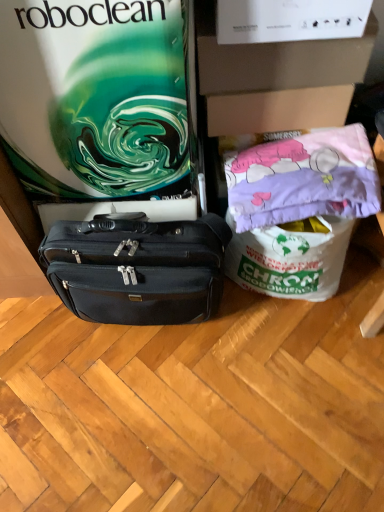
This screenshot has width=384, height=512. What do you see at coordinates (277, 60) in the screenshot? I see `white cardboard box at upper center` at bounding box center [277, 60].

The width and height of the screenshot is (384, 512). In order to click on black leather briefcase at center in this screenshot , I will do `click(137, 268)`.

Identify the location of white cardboard box at upper center. The width and height of the screenshot is (384, 512). (277, 60).

Is pink fabric pillow at upper right spatially inside matte green swirl at upper left, or outside of it?

The correct answer is: outside.

Who is shorter, pink fabric pillow at upper right or matte green swirl at upper left?

Standing shorter between the two is pink fabric pillow at upper right.

Can you confirm if pink fabric pillow at upper right is smaller than matte green swirl at upper left?

Correct, pink fabric pillow at upper right occupies less space than matte green swirl at upper left.

Considering the relative sizes of pink fabric pillow at upper right and matte green swirl at upper left in the image provided, is pink fabric pillow at upper right thinner than matte green swirl at upper left?

Yes, pink fabric pillow at upper right is thinner than matte green swirl at upper left.

Are matte green swirl at upper left and pink fabric pillow at upper right far apart?

They are positioned close to each other.

Between matte green swirl at upper left and pink fabric pillow at upper right, which one has larger width?

With larger width is matte green swirl at upper left.

How different are the orientations of matte green swirl at upper left and pink fabric pillow at upper right in degrees?

There is a 1.02-degree angle between the facing directions of matte green swirl at upper left and pink fabric pillow at upper right.

How many degrees apart are the facing directions of black leather briefcase at center and matte green swirl at upper left?

The angular difference between black leather briefcase at center and matte green swirl at upper left is 4.75 degrees.

Which point is more forward, (180, 273) or (10, 127)?

Positioned in front is point (10, 127).

Identify the location of luggage and bags on the right of the matte green swirl at upper left. The height and width of the screenshot is (512, 384). (137, 268).

Is point (98, 308) positioned behind point (271, 48)?

Yes, point (98, 308) is behind point (271, 48).

Is black leather briefcase at center shorter than white cardboard box at upper center?

In fact, black leather briefcase at center may be taller than white cardboard box at upper center.

Are black leather briefcase at center and white cardboard box at upper center far apart?

That's not correct — black leather briefcase at center is a little close to white cardboard box at upper center.

Does black leather briefcase at center turn towards white cardboard box at upper center?

No.

Is matte green swirl at upper left bigger than white cardboard box at upper center?

Correct, matte green swirl at upper left is larger in size than white cardboard box at upper center.

Does point (108, 185) lie behind point (326, 62)?

That is True.

Considering the sizes of matte green swirl at upper left and white cardboard box at upper center in the image, is matte green swirl at upper left wider or thinner than white cardboard box at upper center?

matte green swirl at upper left is wider than white cardboard box at upper center.

Where is `box behind the matte green swirl at upper left`? box behind the matte green swirl at upper left is located at coordinates (277, 60).

Are pink fabric pillow at upper right and white cardboard box at upper center beside each other?

There is a gap between pink fabric pillow at upper right and white cardboard box at upper center.

From a real-world perspective, is pink fabric pillow at upper right positioned over white cardboard box at upper center based on gravity?

No, from a real-world perspective, pink fabric pillow at upper right is not on top of white cardboard box at upper center.

From the image's perspective, is pink fabric pillow at upper right on white cardboard box at upper center?

No, from the image's perspective, pink fabric pillow at upper right is not above white cardboard box at upper center.

Is pink fabric pillow at upper right oriented towards white cardboard box at upper center?

No, pink fabric pillow at upper right does not turn towards white cardboard box at upper center.

Is black leather briefcase at center located within white cardboard box at upper center?

No, black leather briefcase at center is not a part of white cardboard box at upper center.

Considering the positions of objects white cardboard box at upper center and black leather briefcase at center in the image provided, who is more to the left, white cardboard box at upper center or black leather briefcase at center?

black leather briefcase at center.

From a real-world perspective, between white cardboard box at upper center and black leather briefcase at center, who is vertically higher?

white cardboard box at upper center is physically above.

You are a GUI agent. You are given a task and a screenshot of the screen. Output one action in this format:
    pyautogui.click(x=<x>, y=<y>)
    Task: Click on the material directly beneath the matte green swirl at upper left (from a real-world perspective)
    The width and height of the screenshot is (384, 512).
    Given the screenshot: What is the action you would take?
    click(x=303, y=179)

The height and width of the screenshot is (512, 384). Find the location of `material on the right of matte green swirl at upper left`. material on the right of matte green swirl at upper left is located at coordinates (303, 179).

Based on their spatial positions, is pink fabric pillow at upper right or white cardboard box at upper center closer to matte green swirl at upper left?

white cardboard box at upper center lies closer to matte green swirl at upper left than the other object.

Looking at the image, which one is located further to pink fabric pillow at upper right, black leather briefcase at center or white cardboard box at upper center?

black leather briefcase at center lies further to pink fabric pillow at upper right than the other object.

When comparing their distances from white cardboard box at upper center, does matte green swirl at upper left or black leather briefcase at center seem closer?

matte green swirl at upper left lies closer to white cardboard box at upper center than the other object.

Based on the photo, estimate the real-world distances between objects in this image. Which object is closer to matte green swirl at upper left, pink fabric pillow at upper right or black leather briefcase at center?

black leather briefcase at center is closer to matte green swirl at upper left.

From the image, which object appears to be nearer to white cardboard box at upper center, black leather briefcase at center or matte green swirl at upper left?

Based on the image, matte green swirl at upper left appears to be nearer to white cardboard box at upper center.

Which object lies nearer to the anchor point white cardboard box at upper center, pink fabric pillow at upper right or matte green swirl at upper left?

pink fabric pillow at upper right is positioned closer to the anchor white cardboard box at upper center.

Estimate the real-world distances between objects in this image. Which object is closer to black leather briefcase at center, white cardboard box at upper center or matte green swirl at upper left?

matte green swirl at upper left lies closer to black leather briefcase at center than the other object.

From the image, which object appears to be nearer to black leather briefcase at center, white cardboard box at upper center or pink fabric pillow at upper right?

Among the two, pink fabric pillow at upper right is located nearer to black leather briefcase at center.

Where is `material that lies between white cardboard box at upper center and black leather briefcase at center from top to bottom`? material that lies between white cardboard box at upper center and black leather briefcase at center from top to bottom is located at coordinates pyautogui.click(x=303, y=179).

Find the location of `material between matte green swirl at upper left and black leather briefcase at center from top to bottom`. material between matte green swirl at upper left and black leather briefcase at center from top to bottom is located at coordinates (303, 179).

Identify the location of gift bag between white cardboard box at upper center and black leather briefcase at center in the up-down direction. (94, 96).

Where is `box between matte green swirl at upper left and pink fabric pillow at upper right in the horizontal direction`? box between matte green swirl at upper left and pink fabric pillow at upper right in the horizontal direction is located at coordinates (277, 60).